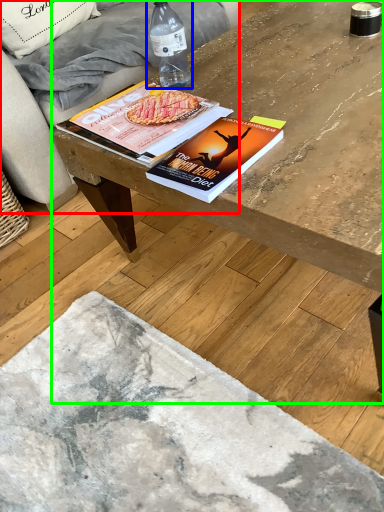
Question: Which object is positioned closest to studio couch (highlighted by a red box)? Select from bottle (highlighted by a blue box) and coffee table (highlighted by a green box).

Choices:
 (A) bottle
 (B) coffee table

Answer: (A)